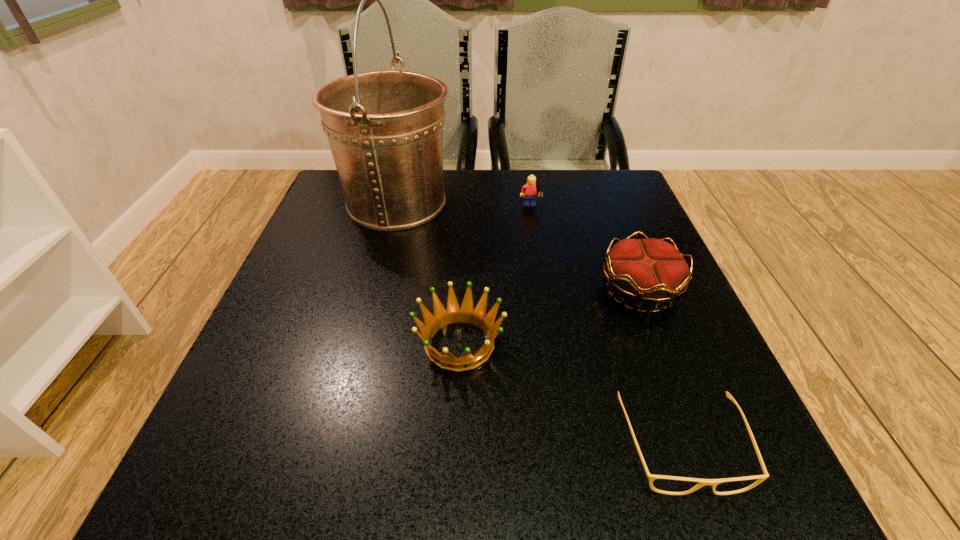
Where is `vacant region between the shortest object and the left crown`? vacant region between the shortest object and the left crown is located at coordinates (570, 395).

The image size is (960, 540). Find the location of `vacant area that lies between the third object from left to right and the left crown`. vacant area that lies between the third object from left to right and the left crown is located at coordinates (495, 276).

You are a GUI agent. You are given a task and a screenshot of the screen. Output one action in this format:
    pyautogui.click(x=<x>, y=<y>)
    Task: Click on the free space that is in between the fourth shortest object and the bucket
    This screenshot has width=960, height=540.
    Given the screenshot: What is the action you would take?
    pyautogui.click(x=464, y=206)

Identify the location of empty space that is in between the spectacles and the Lego. (606, 328).

You are a GUI agent. You are given a task and a screenshot of the screen. Output one action in this format:
    pyautogui.click(x=<x>, y=<y>)
    Task: Click on the free spot between the fourth shortest object and the tallest object
    The image size is (960, 540).
    Given the screenshot: What is the action you would take?
    pyautogui.click(x=464, y=206)

The width and height of the screenshot is (960, 540). Find the location of `free space between the third object from left to right and the tallest object`. free space between the third object from left to right and the tallest object is located at coordinates (464, 206).

Identify which object is the second closest to the right crown. Please provide its 2D coordinates. Your answer should be formatted as a tuple, i.e. [(x, y)], where the tuple contains the x and y coordinates of a point satisfying the conditions above.

[(454, 313)]

Find the location of a particular element. This screenshot has height=540, width=960. the third closest object to the bucket is located at coordinates (650, 271).

At what (x,y) coordinates should I click in order to perform the action: click on free space that satisfies the following two spatial constraints: 1. on the front-facing side of the right crown; 2. on the left side of the second tallest object. Please return your answer as a coordinate pair (x, y). Looking at the image, I should click on [543, 290].

The image size is (960, 540). Find the location of `vacant area in the image that satisfies the following two spatial constraints: 1. on the front-facing side of the third object from left to right; 2. on the right side of the right crown`. vacant area in the image that satisfies the following two spatial constraints: 1. on the front-facing side of the third object from left to right; 2. on the right side of the right crown is located at coordinates (543, 290).